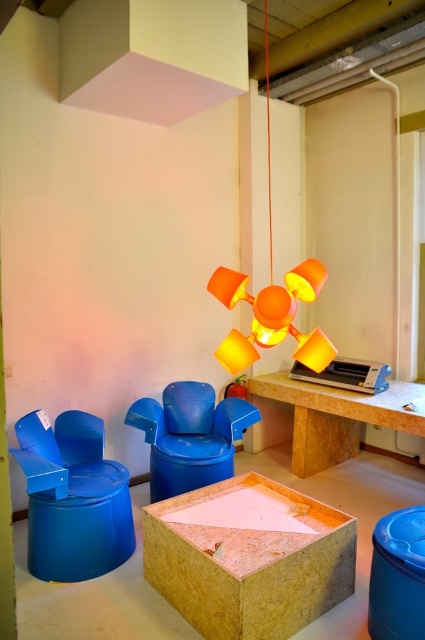
You are moving a 3.5 feet wide painting and want to place it between the wooden table at center and the blue plastic lid at lower right. Is there enough space for it?

Result: The wooden table at center and blue plastic lid at lower right are 4.30 feet apart from each other. Since the painting is 3.5 feet wide, there is enough space between them to place the painting.

Based on the photo, you are an interior designer planning to place a tall plant next to the orange matte lampshade at center and the blue plastic lid at lower right. Which object should the plant be placed next to so that it doesn not block the view of the shorter object?

The orange matte lampshade at center is much taller than the blue plastic lid at lower right, so placing the plant next to the blue plastic lid at lower right would prevent it from blocking the view of the shorter object.